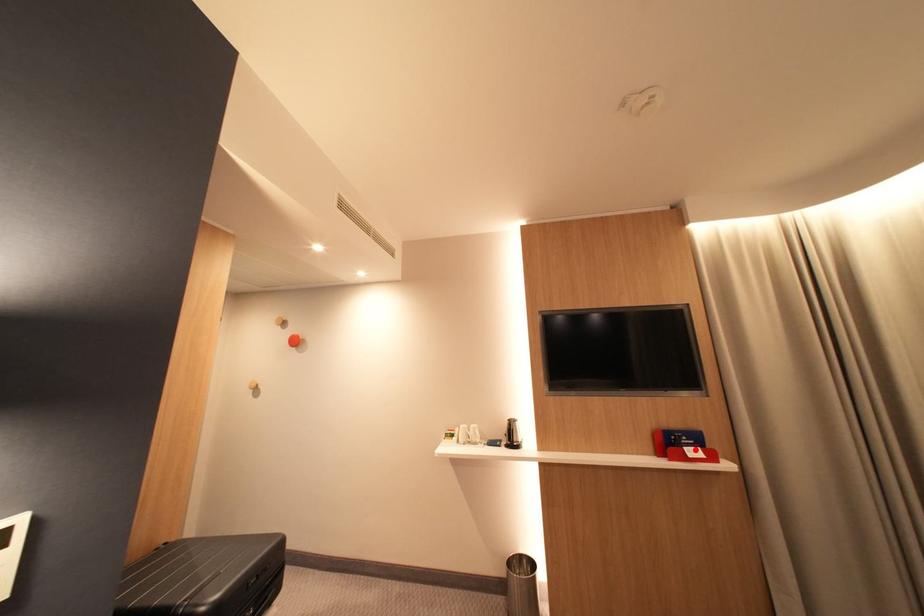
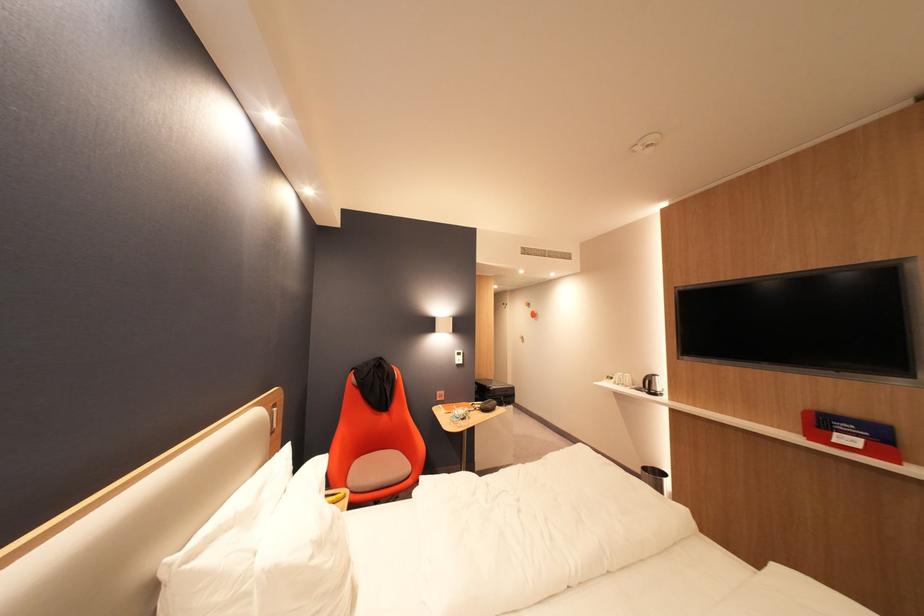
Question: I am providing you with two images of the same scene from different viewpoints. A red point is marked on the first image. Can you still see the location of the red point in image 2?

Choices:
 (A) Yes
 (B) No

Answer: (A)